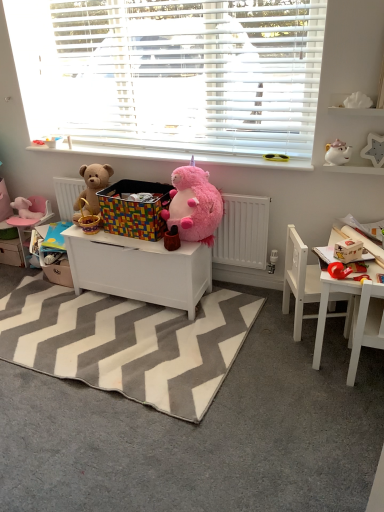
The image size is (384, 512). Identify the location of free space in front of white glossy table at right, positioned as the 1th table in right-to-left order. (333, 411).